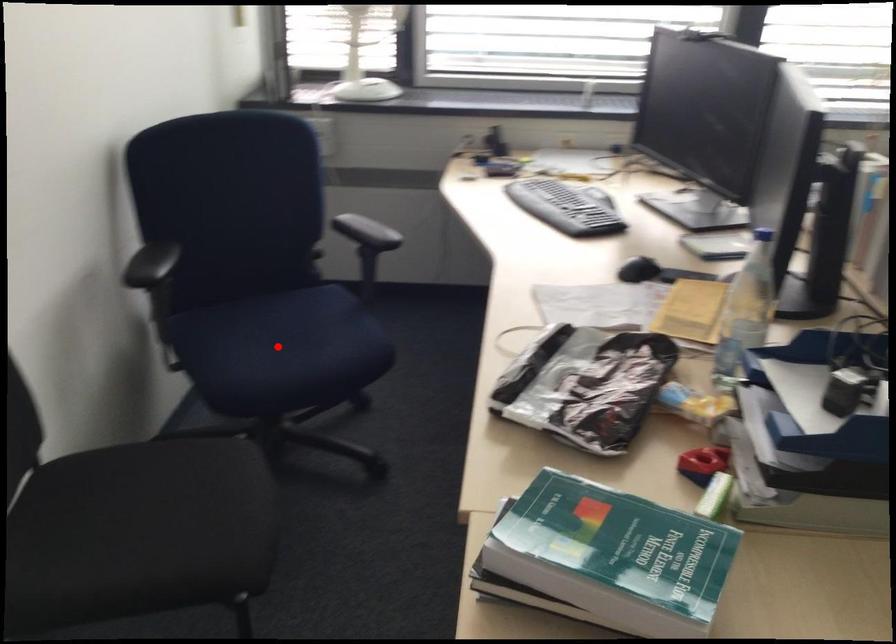
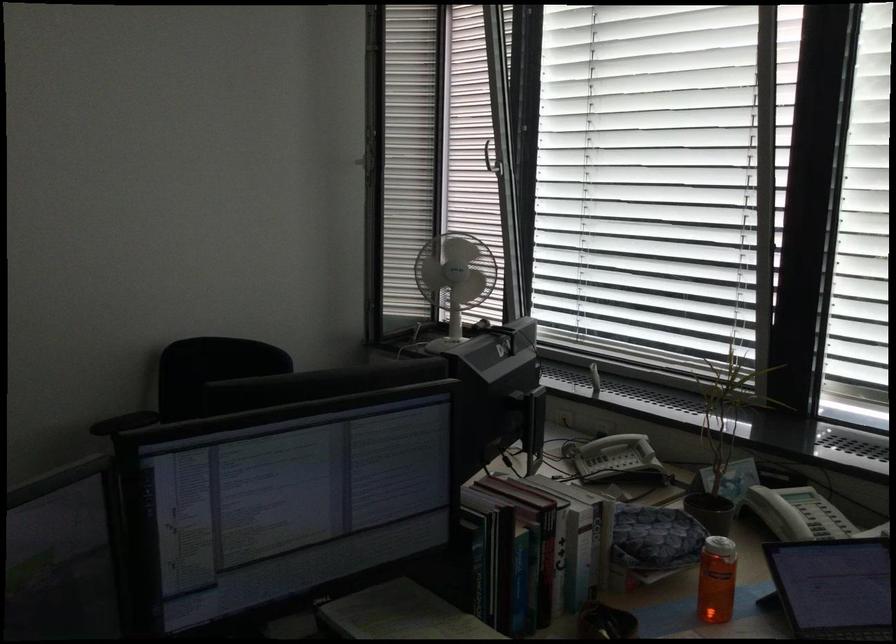
Question: I am providing you with two images of the same scene from different viewpoints. A red point is marked on the first image. Can you still see the location of the red point in image 2?

Choices:
 (A) Yes
 (B) No

Answer: (B)